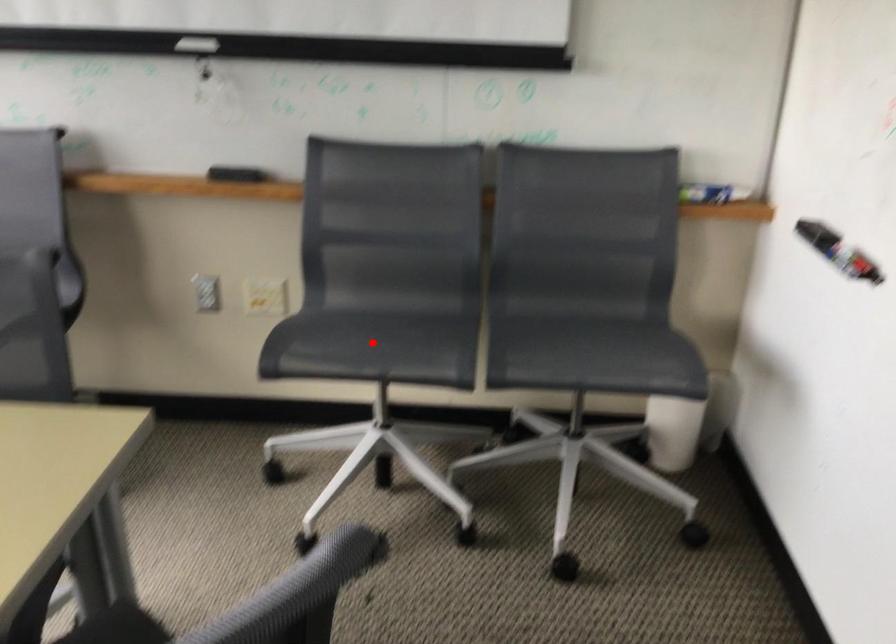
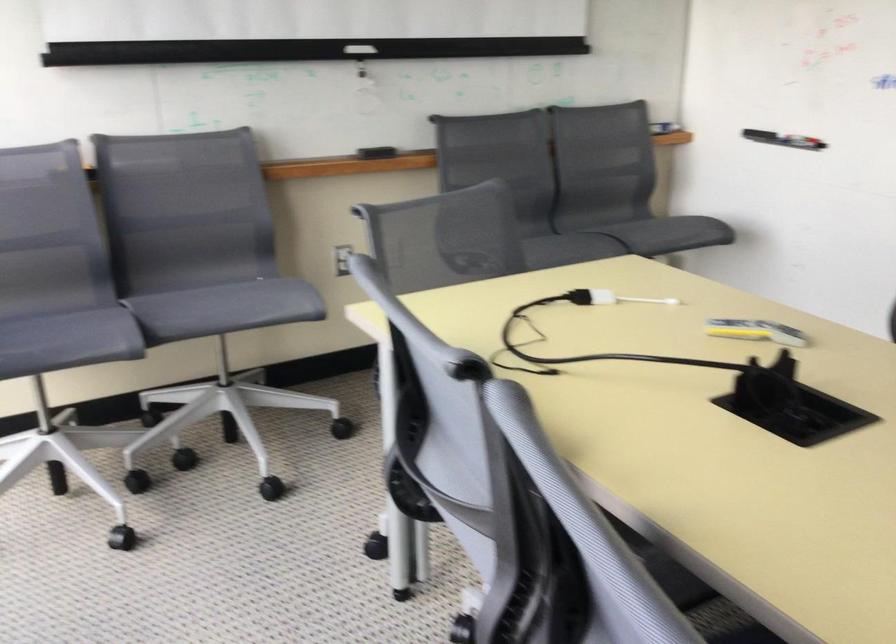
The point at the highlighted location is marked in the first image. Where is the corresponding point in the second image?

(538, 247)